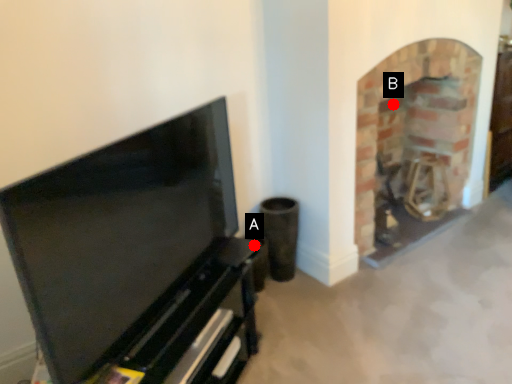
Question: Two points are circled on the image, labeled by A and B beside each circle. Which point is closer to the camera taking this photo?

Choices:
 (A) A is closer
 (B) B is closer

Answer: (A)